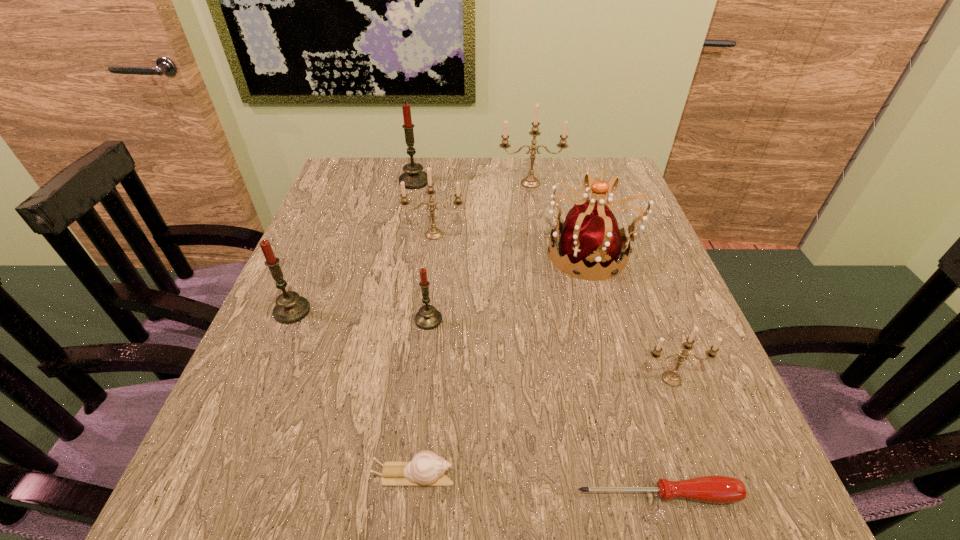
Image resolution: width=960 pixels, height=540 pixels. Find the location of `the farthest red candle`. the farthest red candle is located at coordinates (414, 178).

Where is `the second red candle from left to right`? The image size is (960, 540). the second red candle from left to right is located at coordinates (414, 178).

The height and width of the screenshot is (540, 960). I want to click on the biggest metallic candle, so click(x=530, y=181).

Locate an element on the screen. The width and height of the screenshot is (960, 540). the second metallic candle from right to left is located at coordinates (530, 181).

At what (x,y) coordinates should I click in order to perform the action: click on tiara. Please return your answer as a coordinate pair (x, y). This screenshot has height=540, width=960. Looking at the image, I should click on tap(590, 238).

Where is `the leftmost candle`? This screenshot has width=960, height=540. the leftmost candle is located at coordinates (290, 308).

You are a GUI agent. You are given a task and a screenshot of the screen. Output one action in this format:
    pyautogui.click(x=<x>, y=<y>)
    Task: Click on the second smallest red candle
    
    Given the screenshot: What is the action you would take?
    pyautogui.click(x=290, y=308)

This screenshot has height=540, width=960. Identify the location of the leftmost metallic candle. (433, 233).

Locate an element on the screen. the second nearest metallic candle is located at coordinates (433, 233).

Image resolution: width=960 pixels, height=540 pixels. In order to click on the rightmost red candle in this screenshot , I will do `click(427, 318)`.